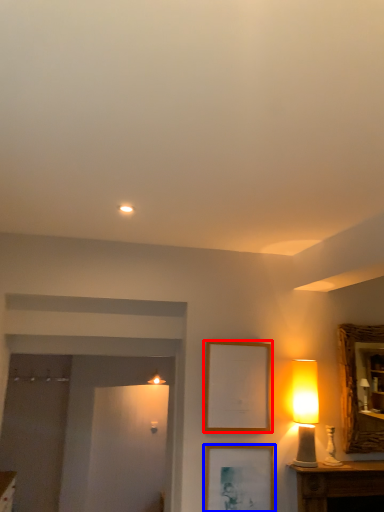
Question: Which of the following is the closest to the observer, picture frame (highlighted by a red box) or picture frame (highlighted by a blue box)?

Choices:
 (A) picture frame
 (B) picture frame

Answer: (B)